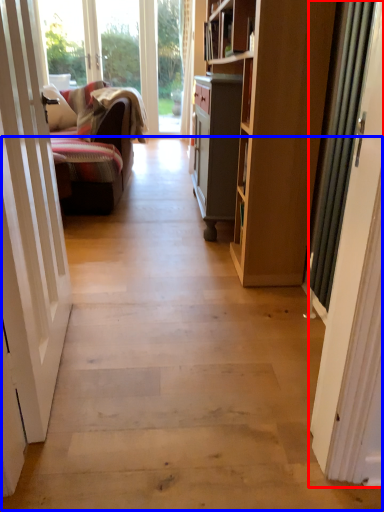
Question: Which object appears closest to the camera in this image, door (highlighted by a red box) or path (highlighted by a blue box)?

Choices:
 (A) door
 (B) path

Answer: (B)